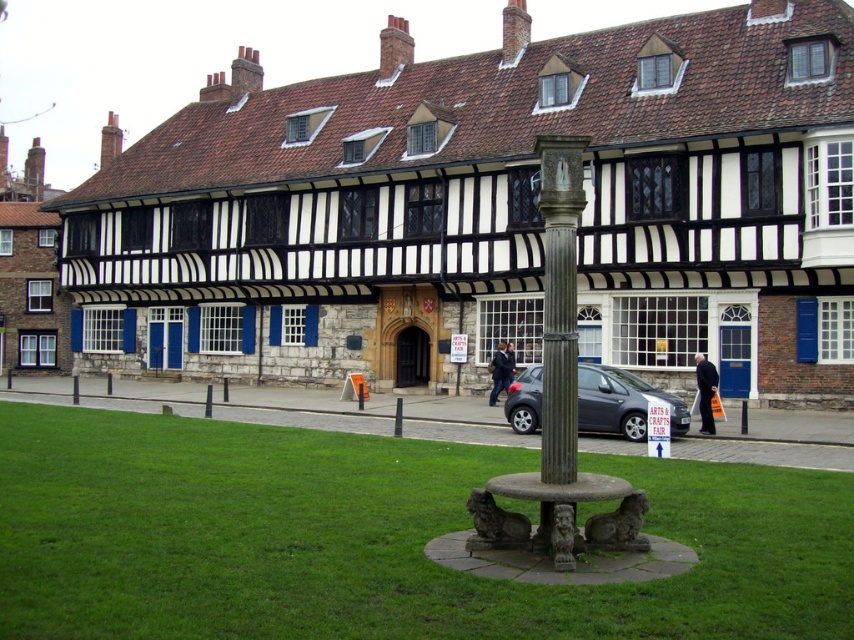
You are planning to host a small outdoor event and need to know if there is enough space on the green grass at center and matte gray car at center for 10 guests. Based on the scene description, which area can accommodate more people?

The matte gray car at center occupies more space than the green grass at center, so it can accommodate more people.

You are standing in front of the historic Tudor building and see the green grass at center and the matte gray car at center. Which object is nearer to you?

The green grass at center is closer to the viewer than the matte gray car at center.

You are a delivery person who needs to park your matte gray car at center as close as possible to the green grass at center. According to the scene, what is the minimum distance you can achieve between them?

The minimum distance you can achieve between the green grass at center and the matte gray car at center is 8.96 meters.